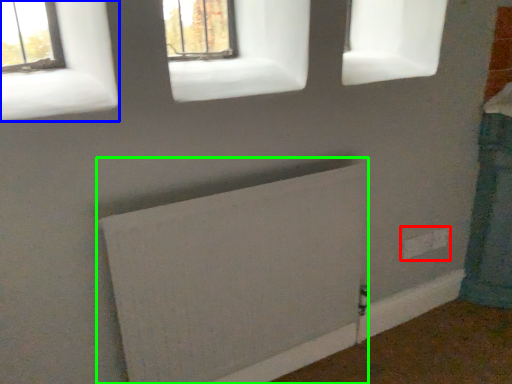
Question: Based on their relative distances, which object is farther from electric outlet (highlighted by a red box)? Choose from window (highlighted by a blue box) and radiator (highlighted by a green box).

Choices:
 (A) window
 (B) radiator

Answer: (A)